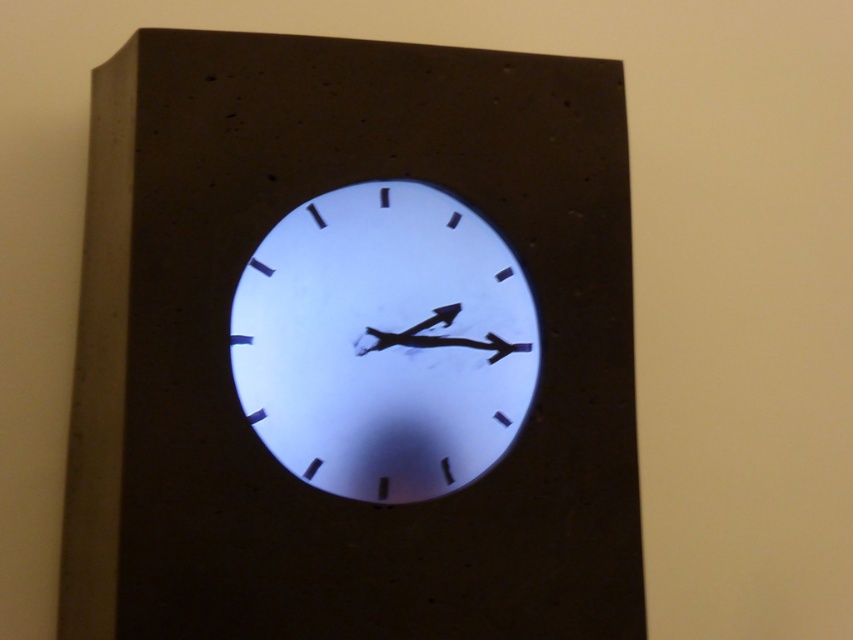
You are standing in front of a wall with two clocks. You see the white matte clock at center and the white glossy clock at center. Which one is positioned to the left?

The white matte clock at center is positioned to the left of the white glossy clock at center.

You are standing in front of a wall with a clock. The clock is located at coordinates 0.541 on the x and 0.414 on the y. If you want to place a picture frame exactly to the right of the white matte clock at center, where should you place it?

To place the picture frame exactly to the right of the white matte clock at center, you should position it at a higher x coordinate than 0.541 while keeping the y coordinate at 0.414.

You are an interior designer and want to choose between the white matte clock at center and the white glossy clock at center for a client who prefers a larger clock. Which one should you recommend?

The white matte clock at center has a larger width than the white glossy clock at center, so it is the better choice for the client who prefers a larger clock.